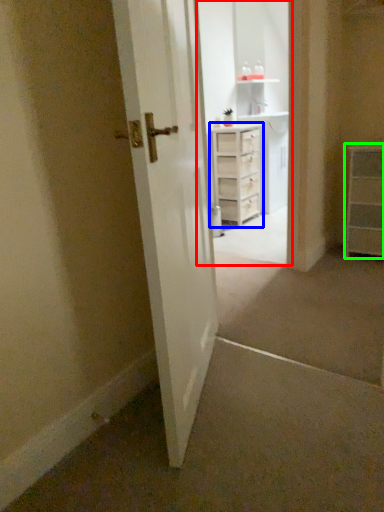
Question: Which object is positioned closest to entertainment center (highlighted by a red box)? Select from chest of drawers (highlighted by a blue box) and chest of drawers (highlighted by a green box).

Choices:
 (A) chest of drawers
 (B) chest of drawers

Answer: (A)